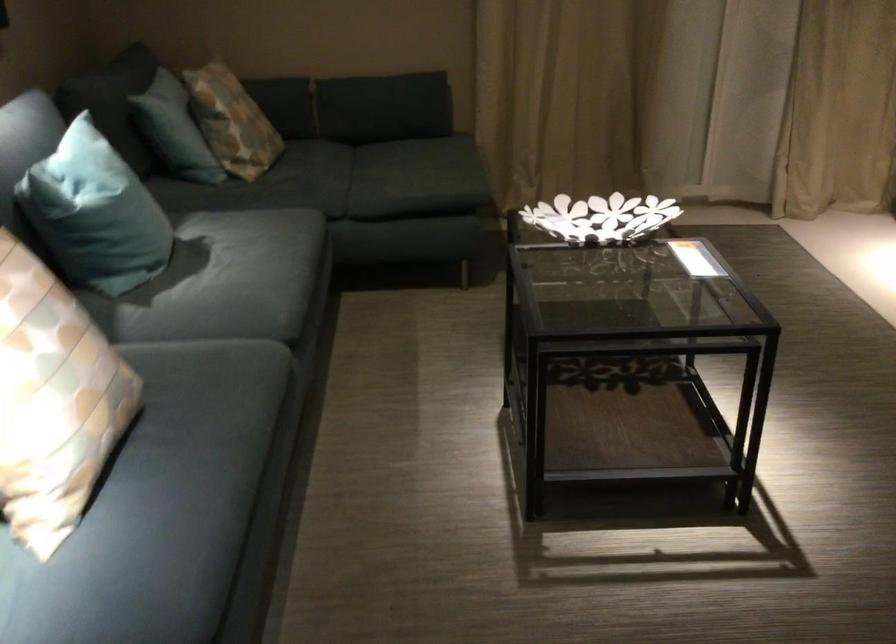
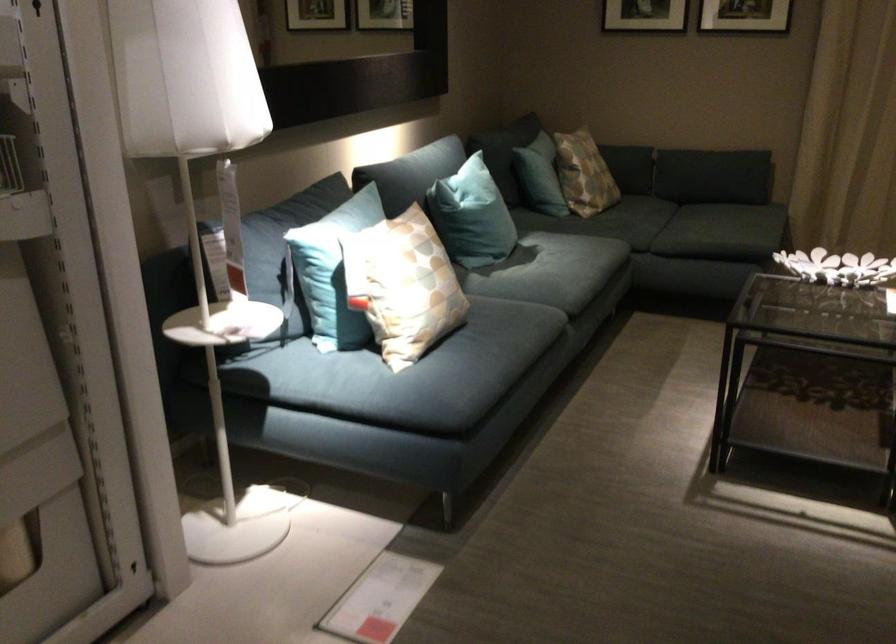
Locate, in the second image, the point that corresponds to point (247, 296) in the first image.

(552, 275)